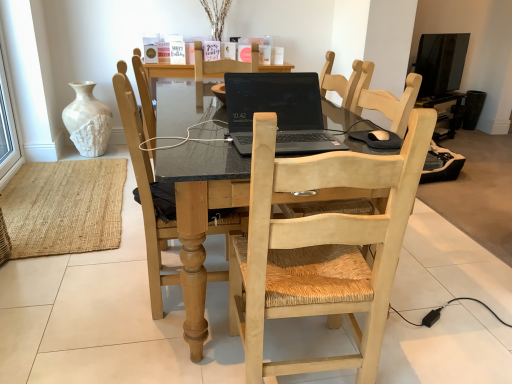
Question: From a real-world perspective, is black matte laptop at center on light wood woven seat at center, arranged as the first chair when viewed from the right?

Choices:
 (A) yes
 (B) no

Answer: (A)

Question: Would you say black matte laptop at center contains light wood woven seat at center, the 2th chair in the left-to-right sequence?

Choices:
 (A) yes
 (B) no

Answer: (B)

Question: Is black matte laptop at center bigger than light wood woven seat at center, arranged as the first chair when viewed from the right?

Choices:
 (A) yes
 (B) no

Answer: (B)

Question: Considering the relative positions of black matte laptop at center and light wood woven seat at center, arranged as the first chair when viewed from the right, in the image provided, is black matte laptop at center to the right of light wood woven seat at center, arranged as the first chair when viewed from the right, from the viewer's perspective?

Choices:
 (A) yes
 (B) no

Answer: (B)

Question: Is black matte laptop at center further to the viewer compared to light wood woven seat at center, arranged as the first chair when viewed from the right?

Choices:
 (A) yes
 (B) no

Answer: (A)

Question: Considering the positions of point pyautogui.click(x=105, y=109) and point pyautogui.click(x=435, y=92), is point pyautogui.click(x=105, y=109) closer or farther from the camera than point pyautogui.click(x=435, y=92)?

Choices:
 (A) closer
 (B) farther

Answer: (A)

Question: In the image, is white textured vase at upper left positioned in front of or behind black glossy tv at upper right?

Choices:
 (A) front
 (B) behind

Answer: (A)

Question: Considering the positions of white textured vase at upper left and black glossy tv at upper right in the image, is white textured vase at upper left bigger or smaller than black glossy tv at upper right?

Choices:
 (A) big
 (B) small

Answer: (A)

Question: From a real-world perspective, is white textured vase at upper left positioned above or below black glossy tv at upper right?

Choices:
 (A) below
 (B) above

Answer: (A)

Question: Does point (456, 46) appear closer or farther from the camera than point (295, 100)?

Choices:
 (A) farther
 (B) closer

Answer: (A)

Question: Looking at their shapes, would you say black glossy tv at upper right is wider or thinner than black matte laptop at center?

Choices:
 (A) thin
 (B) wide

Answer: (A)

Question: Considering the positions of black glossy tv at upper right and black matte laptop at center in the image, is black glossy tv at upper right bigger or smaller than black matte laptop at center?

Choices:
 (A) big
 (B) small

Answer: (A)

Question: Considering the positions of black glossy tv at upper right and black matte laptop at center in the image, is black glossy tv at upper right taller or shorter than black matte laptop at center?

Choices:
 (A) short
 (B) tall

Answer: (B)

Question: In terms of width, does light wood woven seat at center, arranged as the first chair when viewed from the right, look wider or thinner when compared to black matte laptop at center?

Choices:
 (A) thin
 (B) wide

Answer: (B)

Question: From the image's perspective, relative to black matte laptop at center, is light wood woven seat at center, the 2th chair in the left-to-right sequence, above or below?

Choices:
 (A) below
 (B) above

Answer: (A)